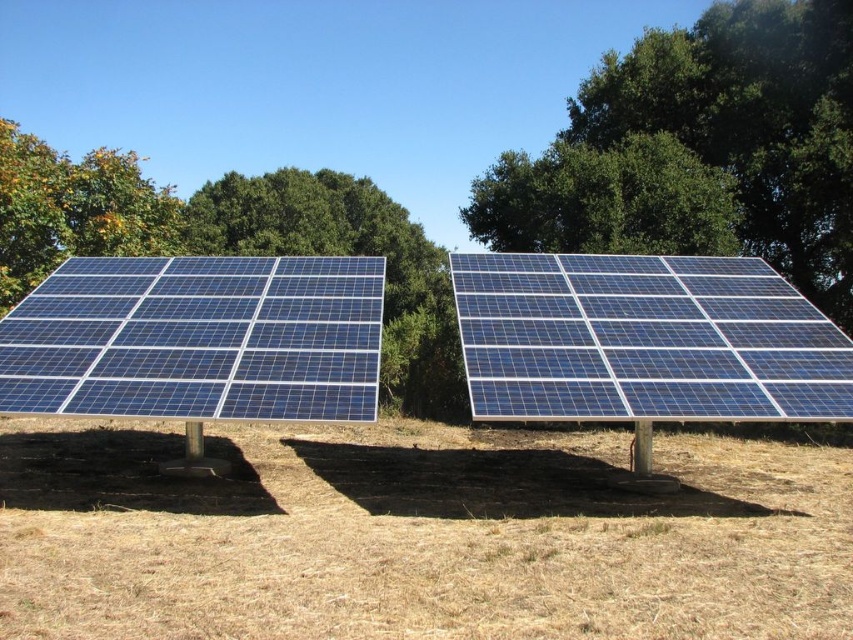
Question: Which point appears closest to the camera in this image?

Choices:
 (A) (160, 220)
 (B) (498, 442)

Answer: (B)

Question: Considering the relative positions of blue glass solar panel at left and green leafy tree at center in the image provided, where is blue glass solar panel at left located with respect to green leafy tree at center?

Choices:
 (A) right
 (B) left

Answer: (A)

Question: Observing the image, what is the correct spatial positioning of brown dry grass at center in reference to green leafy tree at upper center?

Choices:
 (A) left
 (B) right

Answer: (A)

Question: Is brown dry grass at center further to camera compared to green leafy tree at center?

Choices:
 (A) yes
 (B) no

Answer: (B)

Question: Which object is the closest to the blue glass solar panel at right?

Choices:
 (A) brown dry grass at center
 (B) blue glass solar panel at left
 (C) green leafy tree at upper left

Answer: (A)

Question: Among these points, which one is nearest to the camera?

Choices:
 (A) (653, 285)
 (B) (357, 349)
 (C) (112, 172)
 (D) (746, 236)

Answer: (B)